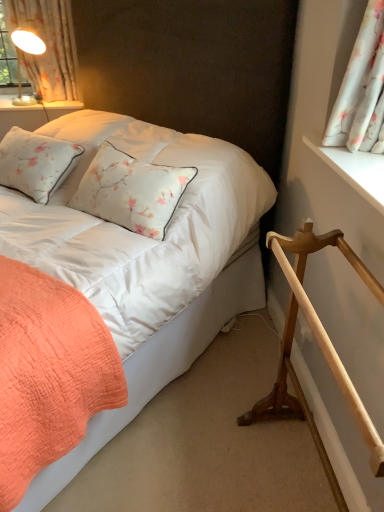
Question: Is light brown wooden rail at lower right positioned far away from white floral fabric at upper right, which is the first curtain in bottom-to-top order?

Choices:
 (A) no
 (B) yes

Answer: (A)

Question: Could you tell me if light brown wooden rail at lower right is facing white floral fabric at upper right, which ranks as the second curtain in left-to-right order?

Choices:
 (A) no
 (B) yes

Answer: (A)

Question: Is light brown wooden rail at lower right to the right of white floral fabric at upper right, the 2th curtain when ordered from back to front, from the viewer's perspective?

Choices:
 (A) no
 (B) yes

Answer: (A)

Question: Does light brown wooden rail at lower right appear on the left side of white floral fabric at upper right, which is counted as the first curtain, starting from the front?

Choices:
 (A) no
 (B) yes

Answer: (B)

Question: Can you confirm if light brown wooden rail at lower right is thinner than white floral fabric at upper right, the 2th curtain when ordered from back to front?

Choices:
 (A) yes
 (B) no

Answer: (B)

Question: Is point (360, 30) closer or farther from the camera than point (321, 443)?

Choices:
 (A) closer
 (B) farther

Answer: (A)

Question: In the image, is white floral fabric at upper right, which is the first curtain in bottom-to-top order, positioned in front of or behind light brown wooden rail at lower right?

Choices:
 (A) front
 (B) behind

Answer: (B)

Question: In terms of size, does white floral fabric at upper right, the second curtain from the top, appear bigger or smaller than light brown wooden rail at lower right?

Choices:
 (A) small
 (B) big

Answer: (A)

Question: In terms of width, does white floral fabric at upper right, which is the first curtain in bottom-to-top order, look wider or thinner when compared to light brown wooden rail at lower right?

Choices:
 (A) thin
 (B) wide

Answer: (A)

Question: From a real-world perspective, is light brown wooden rail at lower right positioned above or below white wooden window sill at upper right?

Choices:
 (A) below
 (B) above

Answer: (A)

Question: Would you say light brown wooden rail at lower right is inside or outside white wooden window sill at upper right?

Choices:
 (A) outside
 (B) inside

Answer: (A)

Question: Is light brown wooden rail at lower right to the left or to the right of white wooden window sill at upper right in the image?

Choices:
 (A) left
 (B) right

Answer: (A)

Question: Relative to white wooden window sill at upper right, is light brown wooden rail at lower right in front or behind?

Choices:
 (A) front
 (B) behind

Answer: (A)

Question: Does point coord(342,391) appear closer or farther from the camera than point coord(41,28)?

Choices:
 (A) farther
 (B) closer

Answer: (B)

Question: Is light brown wooden rail at lower right taller or shorter than white floral fabric at upper left, which ranks as the first curtain in back-to-front order?

Choices:
 (A) short
 (B) tall

Answer: (B)